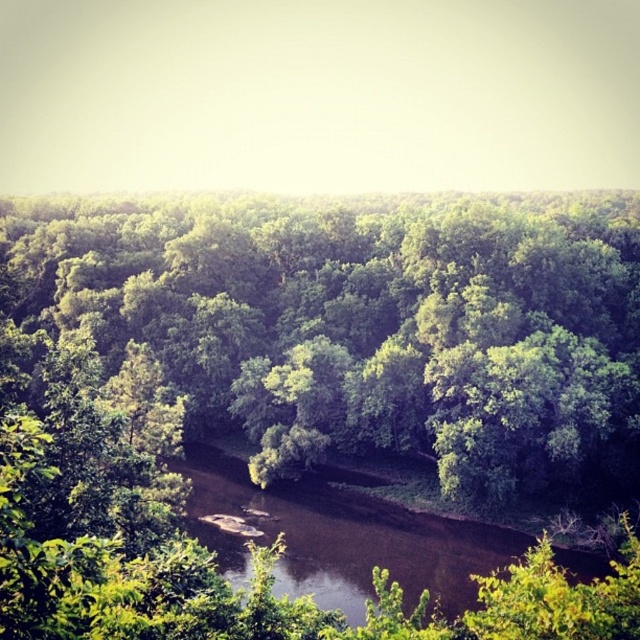
Consider the image. You are a hiker trying to cross the brown smooth river at center. There is a green leafy forest at center nearby. Which direction should you go to avoid the river?

The green leafy forest at center is positioned over the brown smooth river at center, so you should go towards the green leafy forest at center to avoid the river.